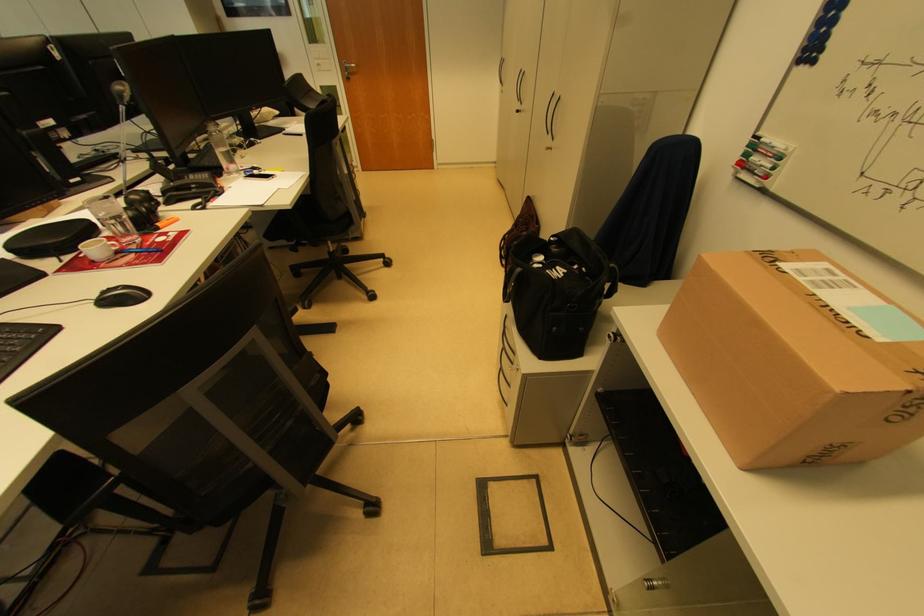
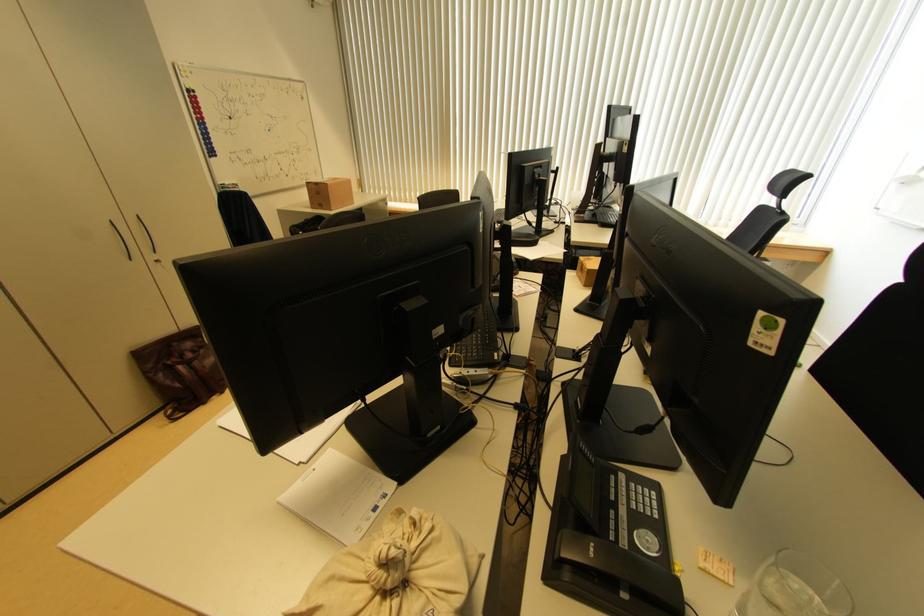
Question: I am providing you with two images of the same scene from different viewpoints. After the viewpoint changes to image2, which objects are now occluded?

Choices:
 (A) telephone handset
 (B) glass cup
 (C) cabinet handle
 (D) black flower vase

Answer: (A)